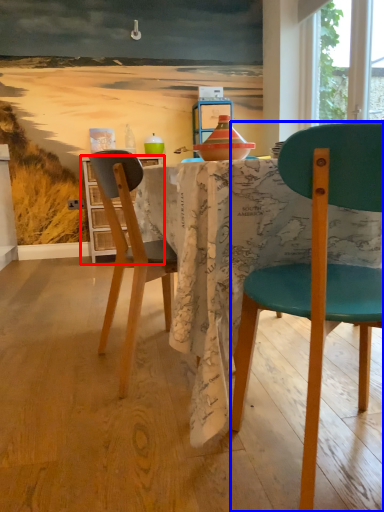
Question: Which of the following is the farthest to the observer, cabinetry (highlighted by a red box) or chair (highlighted by a blue box)?

Choices:
 (A) cabinetry
 (B) chair

Answer: (A)